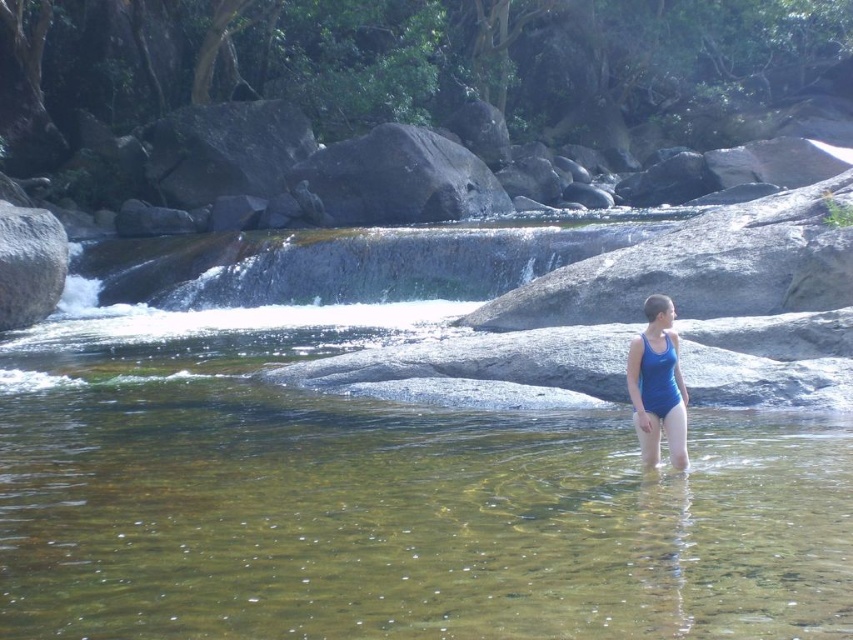
You are planning to cross the river and need to step on the gray rough rock at center and the gray smooth rock at left. Which rock should you choose to step on if you want a wider surface area for stability?

You should choose the gray rough rock at center because its width surpasses that of the gray smooth rock at left, providing a wider and more stable surface area.

You are a swimmer trying to avoid stepping on rocks while crossing the river. You see the gray rough rock at center. Based on its location, can you determine if it is in a safe area to walk around?

The gray rough rock at center is located at point (399, 179). Since the coordinates place it centrally in the riverbed, it might be in a deeper or more central area where the current could be stronger. To stay safe, it is advisable to walk around it cautiously, keeping an eye on the water flow and depth.

You are the person in the blue swimsuit standing in the shallow water. There are two points marked in the image. The first point is at coordinates point (328, 177) and the second is at point (640, 390). If you want to reach the point that is further away from you, which coordinate should you head towards?

Point (328, 177) is behind point (640, 390), so to reach the point further away from you, you should head towards point (328, 177).